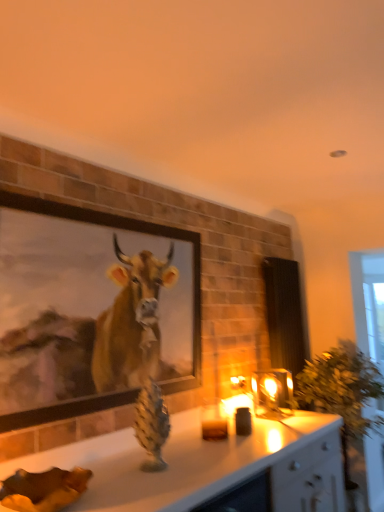
Question: In the image, is wooden framed painting at upper left on the left side or the right side of translucent glass candle at center?

Choices:
 (A) left
 (B) right

Answer: (A)

Question: From a real-world perspective, is wooden framed painting at upper left positioned above or below translucent glass candle at center?

Choices:
 (A) above
 (B) below

Answer: (A)

Question: Which object is the farthest from the green leafy plant at right?

Choices:
 (A) wooden framed painting at upper left
 (B) translucent glass candle at center

Answer: (A)

Question: Which is farther from the translucent glass candle at center?

Choices:
 (A) wooden framed painting at upper left
 (B) green leafy plant at right

Answer: (A)